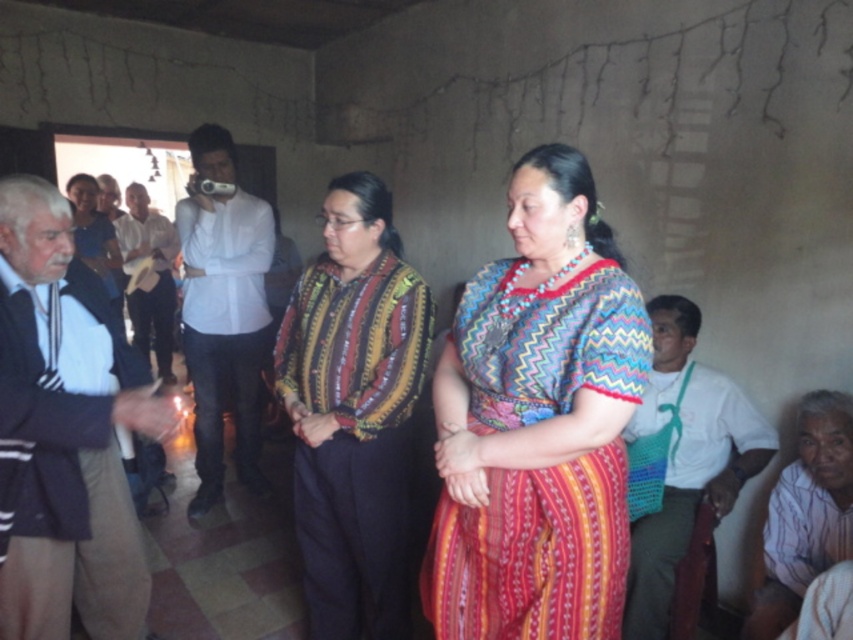
Question: Can you confirm if white striped shirt at lower right is bigger than white cotton shirt at center?

Choices:
 (A) yes
 (B) no

Answer: (B)

Question: Among these objects, which one is farthest from the camera?

Choices:
 (A) white woven bag at right
 (B) dark gray sweater at left
 (C) white cotton shirt at center

Answer: (C)

Question: Where is multicolored woven dress at center located in relation to white woven bag at right in the image?

Choices:
 (A) above
 (B) below

Answer: (A)

Question: Does dark gray sweater at left appear on the right side of white cotton shirt at center?

Choices:
 (A) no
 (B) yes

Answer: (B)

Question: Among these objects, which one is nearest to the camera?

Choices:
 (A) striped fabric shirt at center
 (B) white cotton shirt at center
 (C) white woven bag at right
 (D) white smooth shirt at center

Answer: (A)

Question: Which point is closer to the camera?

Choices:
 (A) white cotton shirt at center
 (B) dark gray sweater at left

Answer: (B)